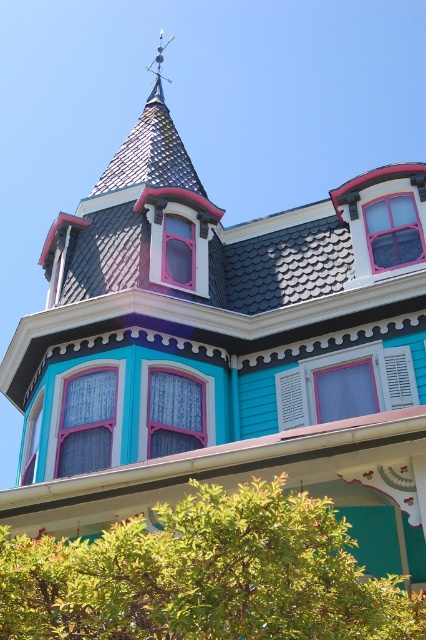
Can you confirm if green leafy tree at lower center is positioned above shiny metal spire at upper center?

No.

Looking at this image, is green leafy tree at lower center taller than shiny metal spire at upper center?

No.

Is point (126, 580) positioned behind point (149, 136)?

No, it is not.

Locate an element on the screen. green leafy tree at lower center is located at coordinates (206, 576).